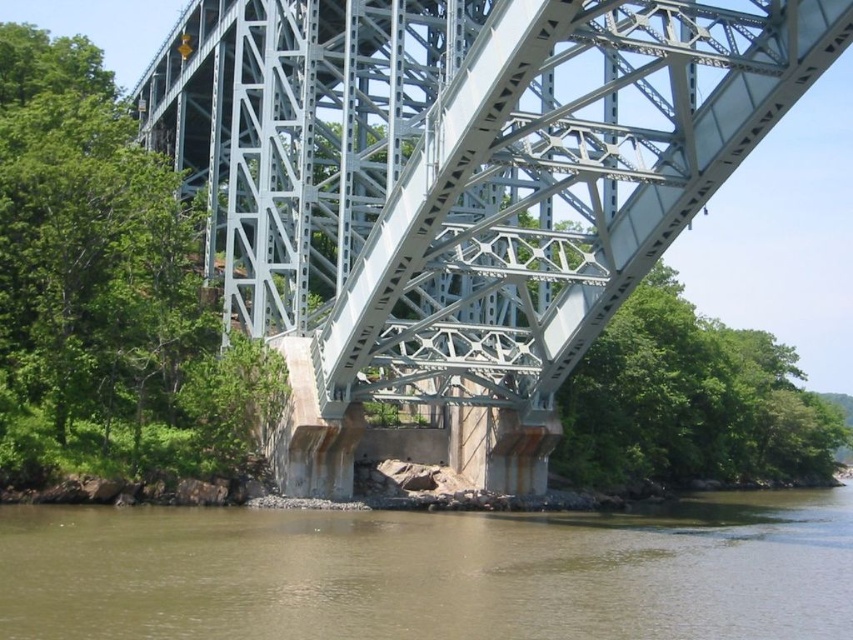
Question: Does metallic steel arch bridge at center lie behind brown sedimentary rock at lower center?

Choices:
 (A) yes
 (B) no

Answer: (A)

Question: Does metallic steel arch bridge at center appear over brown sedimentary rock at lower center?

Choices:
 (A) yes
 (B) no

Answer: (A)

Question: Does metallic steel arch bridge at center have a smaller size compared to brown sedimentary rock at lower center?

Choices:
 (A) yes
 (B) no

Answer: (B)

Question: Which object is farther from the camera taking this photo?

Choices:
 (A) brown sedimentary rock at lower center
 (B) metallic steel arch bridge at center

Answer: (B)

Question: Which object appears closest to the camera in this image?

Choices:
 (A) brown sedimentary rock at lower center
 (B) metallic steel arch bridge at center

Answer: (A)